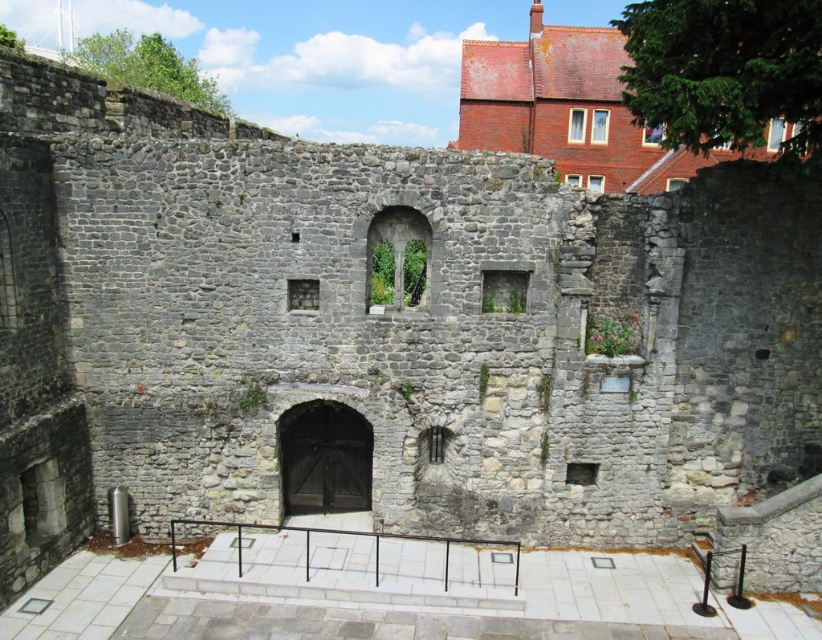
From the picture: Between dark wood door at center and black metal rail at center, which one is positioned lower?

Positioned lower is black metal rail at center.

Which is in front, point (329, 410) or point (377, 554)?

Point (377, 554) is more forward.

The height and width of the screenshot is (640, 822). I want to click on dark wood door at center, so click(x=324, y=458).